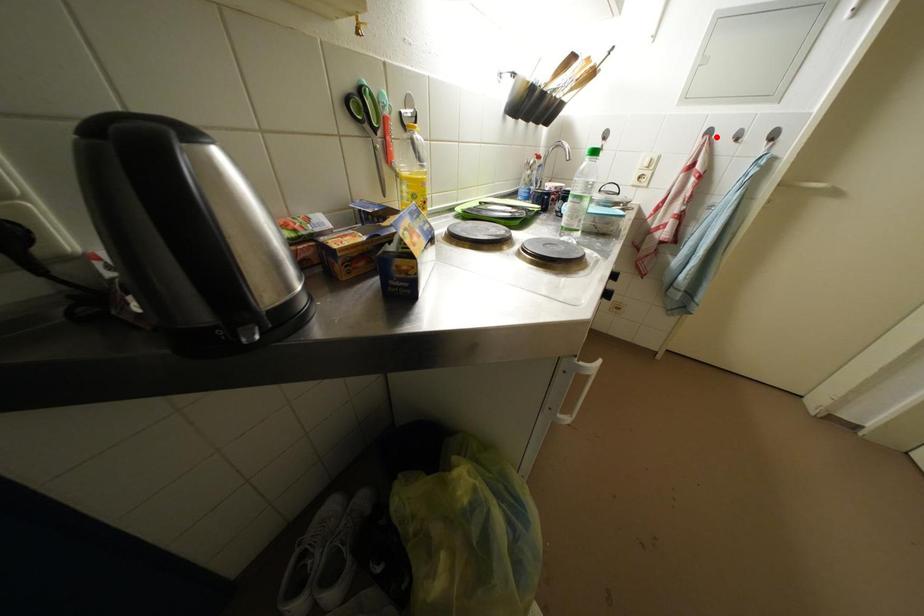
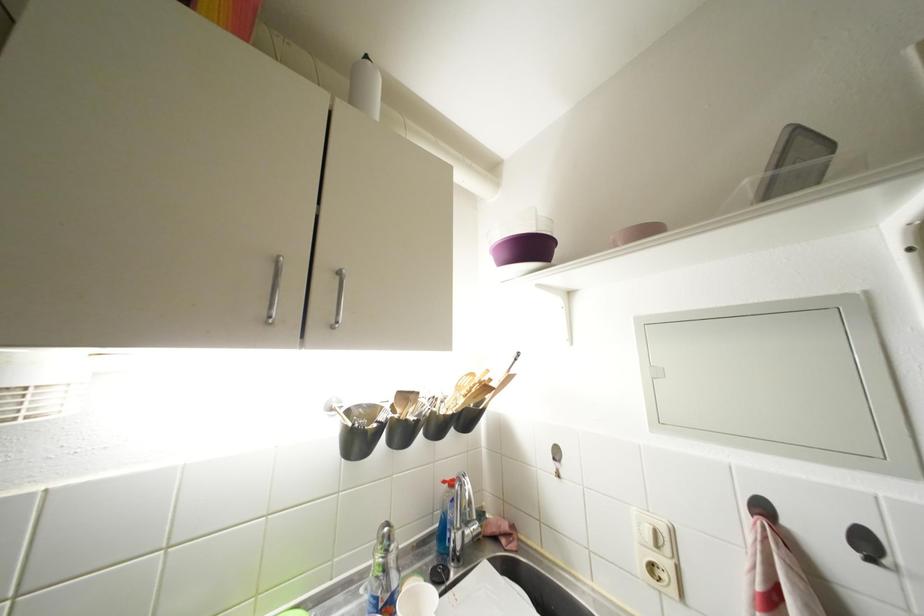
Where in the second image is the point corresponding to the highlighted location from the first image?

(770, 513)